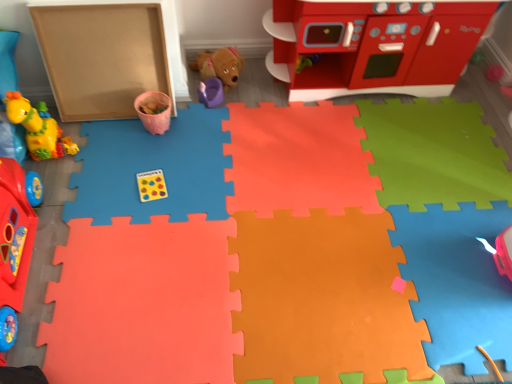
Question: Is smooth plastic play kitchen at upper right, which is the 7th toy from left to right, in front of or behind rubber duck at left, the 6th toy from the left, in the image?

Choices:
 (A) front
 (B) behind

Answer: (B)

Question: In terms of width, does smooth plastic play kitchen at upper right, which is the 7th toy from left to right, look wider or thinner when compared to rubber duck at left, which appears as the 2th toy when viewed from the right?

Choices:
 (A) wide
 (B) thin

Answer: (B)

Question: Which object is the closest to the pink matte cup at upper center, marked as the 5th toy in a right-to-left arrangement?

Choices:
 (A) smooth plastic play kitchen at upper right, acting as the 1th toy starting from the right
 (B) rubber duck at left, which appears as the 2th toy when viewed from the right
 (C) purple plastic cup at center, the fourth toy from the left
 (D) matte cardboard box at left
 (E) rubber duck at left, which is the seventh toy from right to left

Answer: (D)

Question: Which of these objects is positioned farthest from the rubber duck at left, the 6th toy from the left?

Choices:
 (A) rubber duck at left, which is the seventh toy from right to left
 (B) matte yellow giraffe at left, which is the sixth toy in right-to-left order
 (C) pink matte cup at upper center, acting as the third toy starting from the left
 (D) brown plush dog at center, placed as the fifth toy when sorted from left to right
 (E) purple plastic cup at center, the fourth toy from the left

Answer: (D)